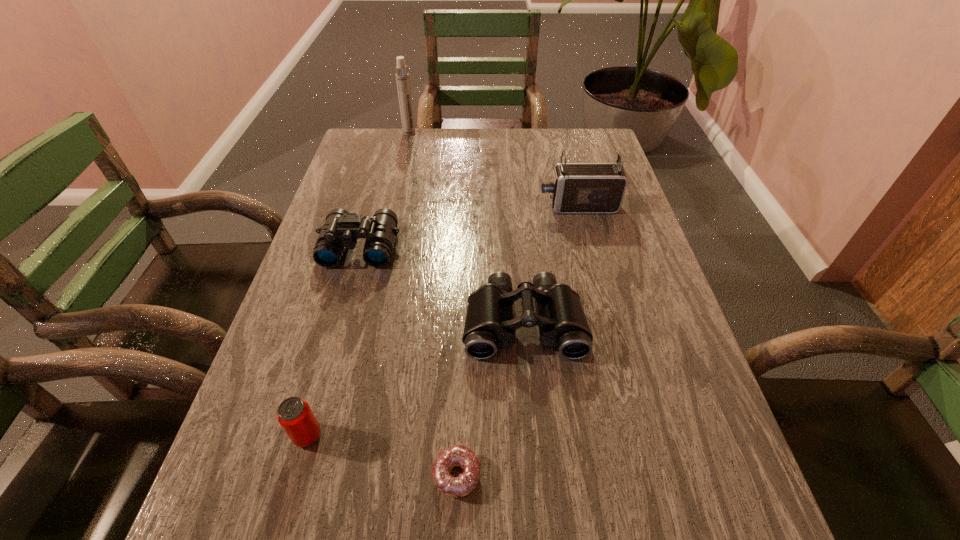
Identify which object is the third closest to the camcorder. Please provide its 2D coordinates. Your answer should be formatted as a tuple, i.e. [(x, y)], where the tuple contains the x and y coordinates of a point satisfying the conditions above.

[(402, 77)]

Choose which object is the third nearest neighbor to the farthest object. Please provide its 2D coordinates. Your answer should be formatted as a tuple, i.e. [(x, y)], where the tuple contains the x and y coordinates of a point satisfying the conditions above.

[(489, 324)]

This screenshot has width=960, height=540. In order to click on free location that satisfies the following two spatial constraints: 1. through the lenses of the nearest object; 2. on the right side of the farther binoculars in this screenshot , I will do `click(296, 475)`.

The width and height of the screenshot is (960, 540). In order to click on free spot that satisfies the following two spatial constraints: 1. at the lens of the camcorder; 2. on the front side of the second nearest object in this screenshot , I will do pos(636,435).

Find the location of `free space that satisfies the following two spatial constraints: 1. through the lenses of the farther binoculars; 2. on the right side of the fifth farthest object`. free space that satisfies the following two spatial constraints: 1. through the lenses of the farther binoculars; 2. on the right side of the fifth farthest object is located at coordinates (307, 435).